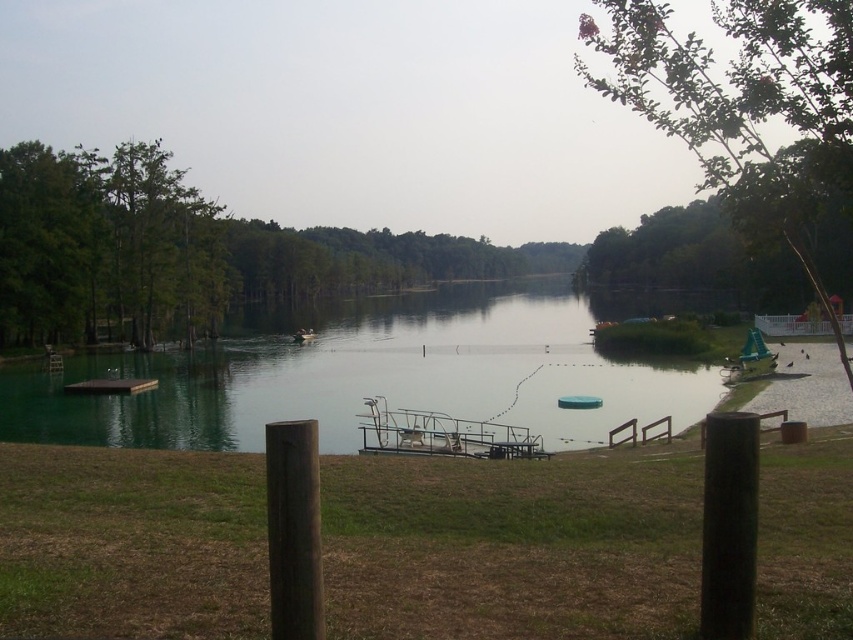
Question: Can you confirm if green matte dock at lower left is thinner than green plastic boat at right?

Choices:
 (A) no
 (B) yes

Answer: (A)

Question: Is green water at center bigger than green plastic boat at right?

Choices:
 (A) no
 (B) yes

Answer: (B)

Question: Is green water at center positioned in front of metallic gray dock at center?

Choices:
 (A) no
 (B) yes

Answer: (A)

Question: Estimate the real-world distances between objects in this image. Which object is farther from the green water at center?

Choices:
 (A) green plastic boat at right
 (B) green plastic boat at center
 (C) green matte dock at lower left

Answer: (A)

Question: Which point is closer to the camera?

Choices:
 (A) (572, 396)
 (B) (434, 397)
 (C) (753, 349)
 (D) (309, 333)

Answer: (A)

Question: Which of the following is the closest to the observer?

Choices:
 (A) coord(757,346)
 (B) coord(315,333)
 (C) coord(567,406)
 (D) coord(544,397)

Answer: (C)